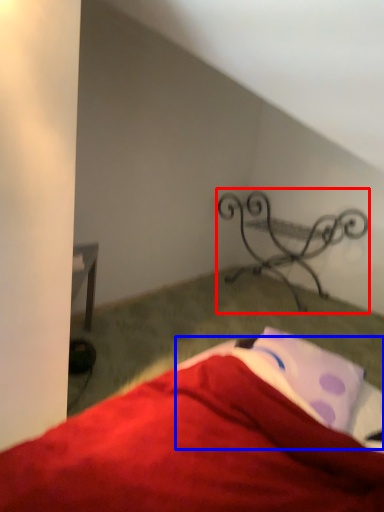
Question: Which object appears closest to the camera in this image, furniture (highlighted by a red box) or sheet (highlighted by a blue box)?

Choices:
 (A) furniture
 (B) sheet

Answer: (B)